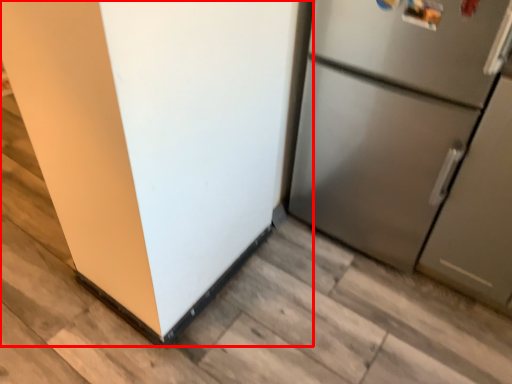
Question: From the image's perspective, considering the relative positions of refrigerator (annotated by the red box) and refrigerator in the image provided, where is refrigerator (annotated by the red box) located with respect to the staircase?

Choices:
 (A) above
 (B) below

Answer: (B)